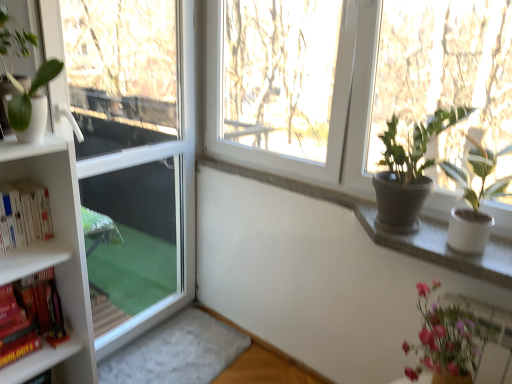
Question: Considering the relative positions of hardcover books at left, the first book ordered from the bottom, and white ceramic pot at upper right in the image provided, is hardcover books at left, the first book ordered from the bottom, to the left or to the right of white ceramic pot at upper right?

Choices:
 (A) right
 (B) left

Answer: (B)

Question: From their relative heights in the image, would you say hardcover books at left, the first book ordered from the bottom, is taller or shorter than white ceramic pot at upper right?

Choices:
 (A) tall
 (B) short

Answer: (A)

Question: Which is nearer to the transparent glass screen door at left?

Choices:
 (A) white ceramic pot at upper right
 (B) pink glossy vase at lower right, acting as the first houseplant starting from the right
 (C) matte white pot at left, placed as the third houseplant when sorted from right to left
 (D) hardcover books at left, the first book ordered from the bottom
 (E) matte gray pot at upper right, marked as the 2th houseplant in a left-to-right arrangement

Answer: (C)

Question: Which object is positioned farthest from the matte gray pot at upper right, placed as the second houseplant when sorted from right to left?

Choices:
 (A) transparent glass screen door at left
 (B) pink glossy vase at lower right, which is counted as the first houseplant, starting from the bottom
 (C) matte white pot at left, which ranks as the 1th houseplant in top-to-bottom order
 (D) hardcover books at left, which is the 2th book in bottom-to-top order
 (E) hardcover books at left, the second book from the top

Answer: (E)